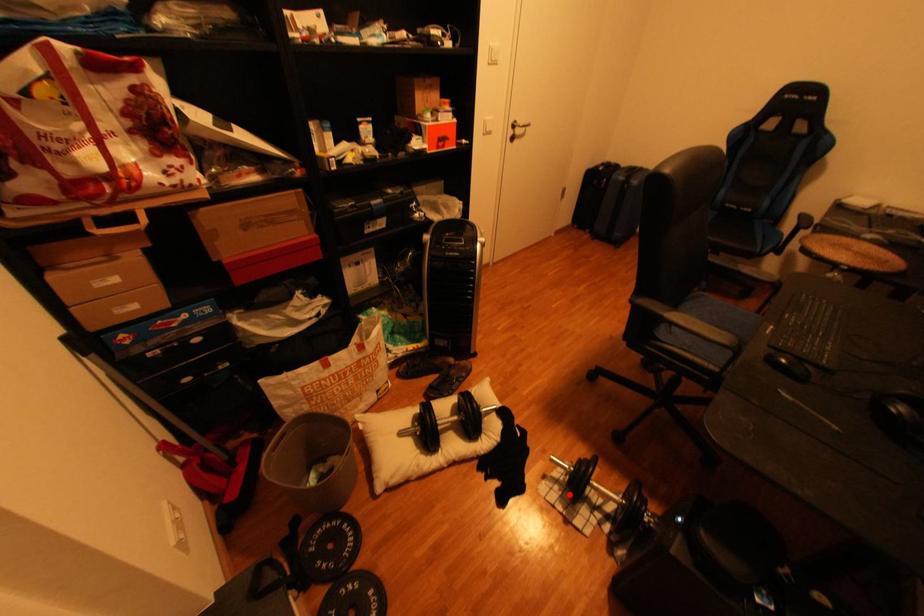
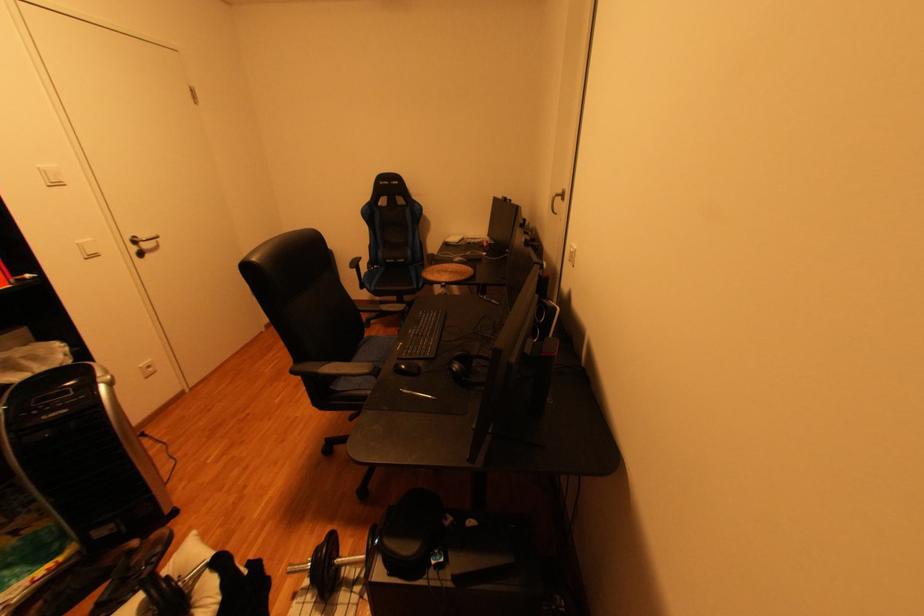
Where in the second image is the point corresponding to the highlighted location from the first image?

(323, 600)